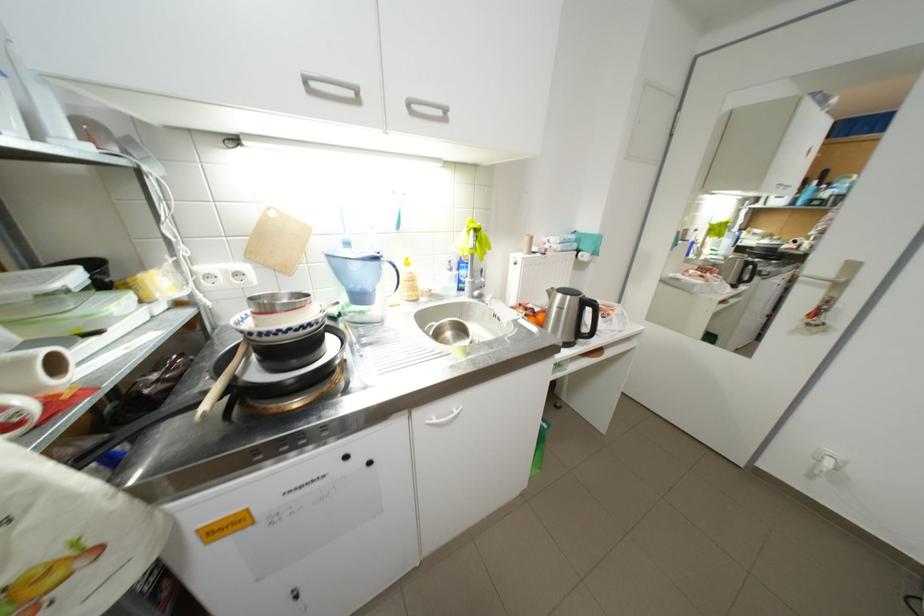
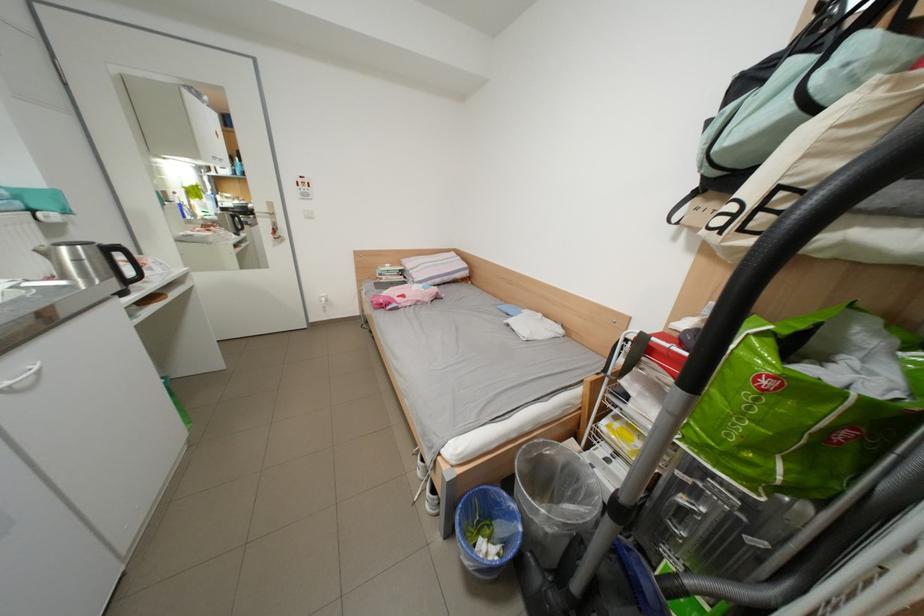
The point at (x=468, y=413) is marked in the first image. Where is the corresponding point in the second image?

(46, 369)